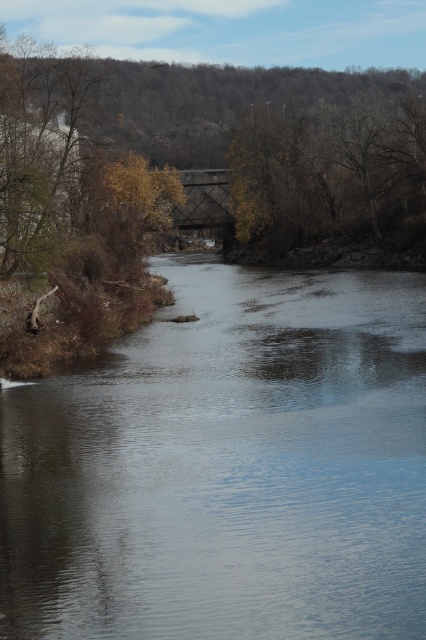
Between clear water at center and brown leafy tree at upper center, which one is positioned higher?

brown leafy tree at upper center is higher up.

Between point (261, 321) and point (334, 200), which one is positioned in front?

Positioned in front is point (261, 321).

Which is in front, point (97, 385) or point (406, 132)?

Point (97, 385)

Where is `clear water at center`? clear water at center is located at coordinates (227, 467).